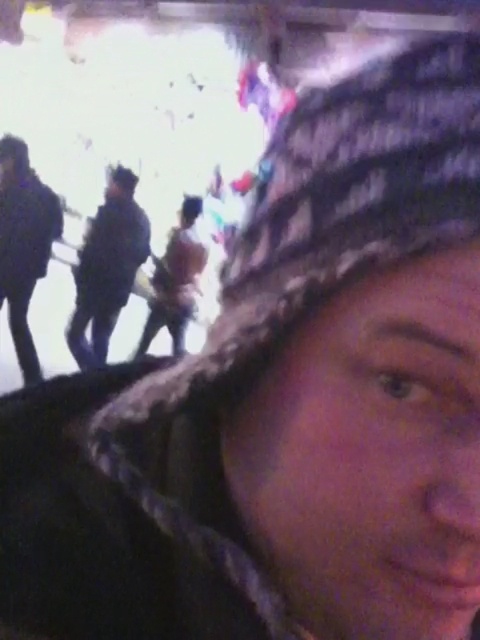
You are a photographer adjusting your camera settings. You want to focus on the dark blue uniform at center. What are the coordinates where you should set the focus point?

The coordinates to focus on the dark blue uniform at center are at point (107, 268).

You are helping organize a costume party and need to decide which outfit to display first. The dark blue uniform at center and the brown fuzzy coat at center are both on a rack. Which one takes up more space on the rack?

The dark blue uniform at center has a larger size compared to the brown fuzzy coat at center, so it takes up more space on the rack.